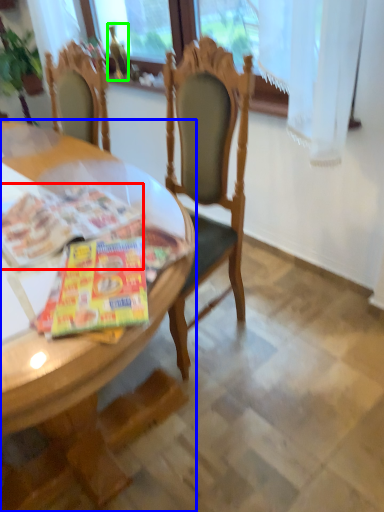
Question: Which object is the closest to the magazine (highlighted by a red box)? Choose among these: desk (highlighted by a blue box) or bottle (highlighted by a green box).

Choices:
 (A) desk
 (B) bottle

Answer: (A)